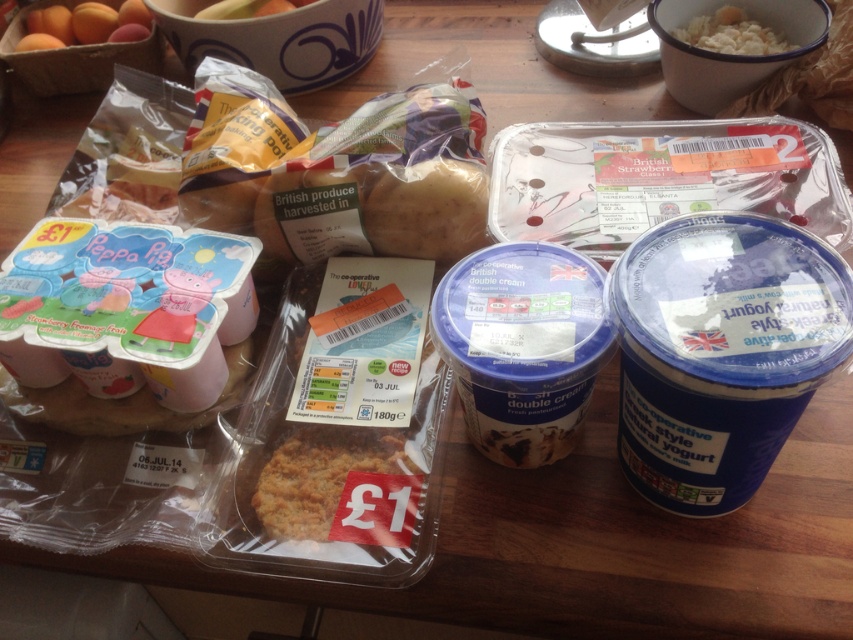
Question: Can you confirm if smooth brown potato at center is positioned to the right of matte plastic bowl at upper center?

Choices:
 (A) no
 (B) yes

Answer: (B)

Question: Can you confirm if smooth orange fruit at upper left is thinner than matte plastic bowl at upper center?

Choices:
 (A) no
 (B) yes

Answer: (A)

Question: Which point is farther to the camera?

Choices:
 (A) blue matte yogurt at center
 (B) white creamy rice at upper right

Answer: (B)

Question: Where is smooth orange fruit at upper left located in relation to matte plastic bowl at upper center in the image?

Choices:
 (A) below
 (B) above

Answer: (A)

Question: Which point appears farthest from the camera in this image?

Choices:
 (A) (289, 4)
 (B) (401, 493)

Answer: (A)

Question: Which object is positioned farthest from the matte plastic bowl at upper center?

Choices:
 (A) white creamy rice at upper right
 (B) smooth orange fruit at upper left
 (C) blue matte yogurt at lower right
 (D) blue matte yogurt at center

Answer: (C)